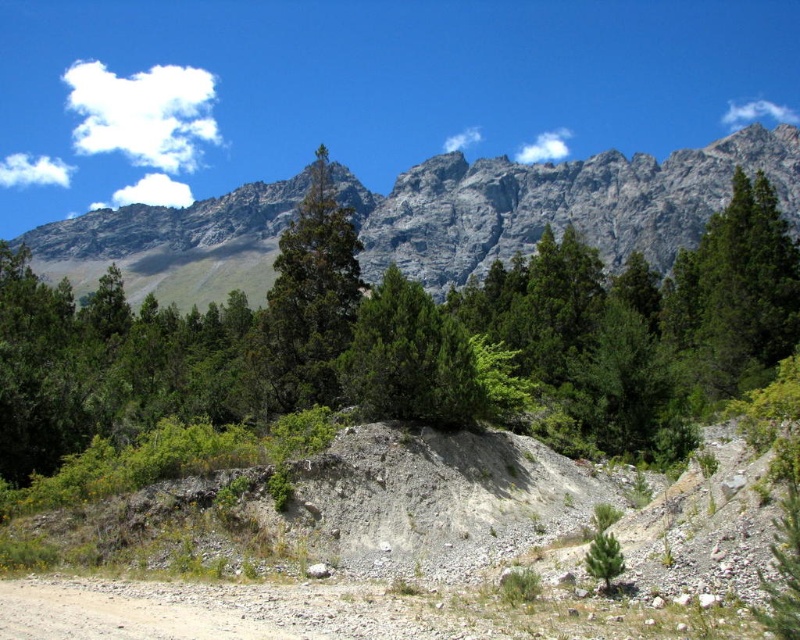
Question: Does green textured tree at upper center appear over green matte tree at center?

Choices:
 (A) yes
 (B) no

Answer: (B)

Question: Does gray rock mountain at upper center appear on the right side of green matte tree at center?

Choices:
 (A) yes
 (B) no

Answer: (B)

Question: Which point is farther to the camera?

Choices:
 (A) (556, 186)
 (B) (528, 332)

Answer: (A)

Question: Does green textured tree at upper center have a lesser width compared to green matte tree at center?

Choices:
 (A) yes
 (B) no

Answer: (B)

Question: Among these objects, which one is farthest from the camera?

Choices:
 (A) green textured tree at upper center
 (B) green matte tree at center
 (C) gray rock mountain at upper center

Answer: (C)

Question: Which object is positioned closest to the green matte tree at center?

Choices:
 (A) green textured tree at upper center
 (B) gray rock mountain at upper center

Answer: (A)